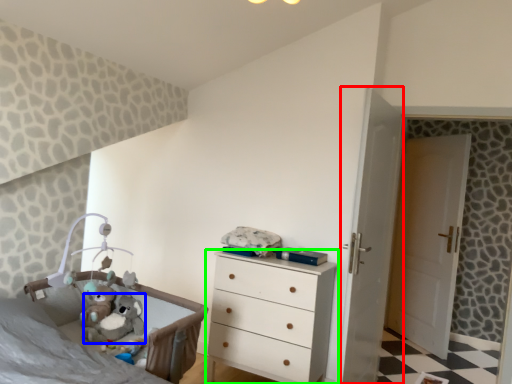
Question: Which object is positioned farthest from screen door (highlighted by a red box)? Select from animal (highlighted by a blue box) and chest of drawers (highlighted by a green box).

Choices:
 (A) animal
 (B) chest of drawers

Answer: (A)